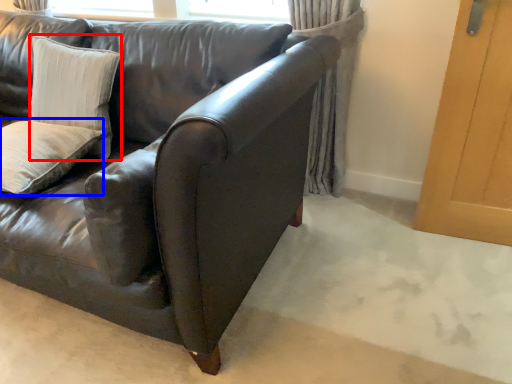
Question: Which point is closer to the camera, pillow (highlighted by a red box) or pillow (highlighted by a blue box)?

Choices:
 (A) pillow
 (B) pillow

Answer: (B)